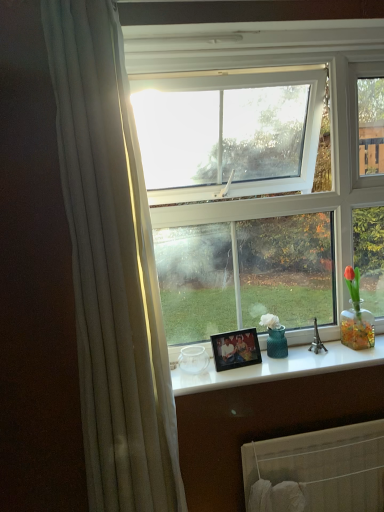
This screenshot has height=512, width=384. Identify the location of vacant point to the right of wooden photo frame at center. (282, 367).